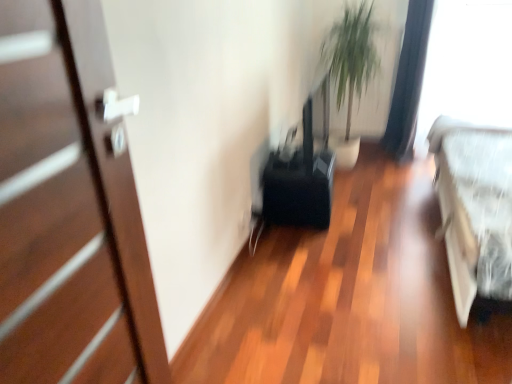
Question: Considering the relative sizes of black fabric curtain at upper right and green leafy plant at upper center in the image provided, is black fabric curtain at upper right wider than green leafy plant at upper center?

Choices:
 (A) yes
 (B) no

Answer: (A)

Question: Considering the relative sizes of black fabric curtain at upper right and green leafy plant at upper center in the image provided, is black fabric curtain at upper right shorter than green leafy plant at upper center?

Choices:
 (A) yes
 (B) no

Answer: (B)

Question: From the image's perspective, is black fabric curtain at upper right on top of green leafy plant at upper center?

Choices:
 (A) no
 (B) yes

Answer: (A)

Question: Is black fabric curtain at upper right with green leafy plant at upper center?

Choices:
 (A) no
 (B) yes

Answer: (A)

Question: Is green leafy plant at upper center at the back of black fabric curtain at upper right?

Choices:
 (A) yes
 (B) no

Answer: (B)

Question: Is green leafy plant at upper center inside or outside of transparent plastic window screen at upper right?

Choices:
 (A) inside
 (B) outside

Answer: (B)

Question: Based on their sizes in the image, would you say green leafy plant at upper center is bigger or smaller than transparent plastic window screen at upper right?

Choices:
 (A) big
 (B) small

Answer: (B)

Question: From their relative heights in the image, would you say green leafy plant at upper center is taller or shorter than transparent plastic window screen at upper right?

Choices:
 (A) tall
 (B) short

Answer: (B)

Question: Is point (333, 26) closer or farther from the camera than point (464, 64)?

Choices:
 (A) farther
 (B) closer

Answer: (A)

Question: From a real-world perspective, relative to white fabric bed at right, is black fabric curtain at upper right vertically above or below?

Choices:
 (A) above
 (B) below

Answer: (A)

Question: Considering their positions, is black fabric curtain at upper right located in front of or behind white fabric bed at right?

Choices:
 (A) front
 (B) behind

Answer: (B)

Question: Based on their sizes in the image, would you say black fabric curtain at upper right is bigger or smaller than white fabric bed at right?

Choices:
 (A) big
 (B) small

Answer: (B)

Question: From the image's perspective, is black fabric curtain at upper right above or below white fabric bed at right?

Choices:
 (A) above
 (B) below

Answer: (A)

Question: In terms of size, does green leafy plant at upper center appear bigger or smaller than matte white door at left?

Choices:
 (A) small
 (B) big

Answer: (A)

Question: Choose the correct answer: Is green leafy plant at upper center inside matte white door at left or outside it?

Choices:
 (A) inside
 (B) outside

Answer: (B)